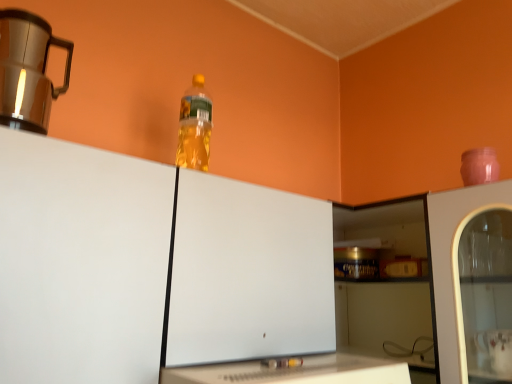
This screenshot has height=384, width=512. What do you see at coordinates (240, 277) in the screenshot?
I see `transparent plastic bottle at upper center` at bounding box center [240, 277].

Locate an element on the screen. translucent plastic bottle at upper center is located at coordinates (195, 127).

The height and width of the screenshot is (384, 512). I want to click on white glossy table at lower center, so click(294, 371).

You are a GUI agent. You are given a task and a screenshot of the screen. Output one action in this format:
    pyautogui.click(x=<x>, y=<y>)
    Task: Click on the brushed metal mug at upper left
    The image size is (512, 384).
    Given the screenshot: What is the action you would take?
    pyautogui.click(x=28, y=70)

Find the location of a particular element. transparent plastic bottle at upper center is located at coordinates (240, 277).

From a real-world perspective, which object stands above the other?

From a 3D spatial view, brushed metal mug at upper left is above.

Is brushed metal mug at upper left at the left side of transparent plastic bottle at upper center?

Yes.

Is brushed metal mug at upper left directly adjacent to transparent plastic bottle at upper center?

No, brushed metal mug at upper left is not with transparent plastic bottle at upper center.

What's the angular difference between brushed metal mug at upper left and translucent plastic bottle at upper center's facing directions?

0.248 degrees.

Which of these two, brushed metal mug at upper left or translucent plastic bottle at upper center, is smaller?

translucent plastic bottle at upper center is smaller.

Looking at this image, is brushed metal mug at upper left taller than translucent plastic bottle at upper center?

No, brushed metal mug at upper left is not taller than translucent plastic bottle at upper center.

From a real-world perspective, which object rests below the other?

brushed metal mug at upper left is physically lower.

From a real-world perspective, is transparent plastic bottle at upper center positioned above or below brushed metal mug at upper left?

transparent plastic bottle at upper center is below brushed metal mug at upper left.

Which is behind, point (322, 342) or point (45, 77)?

The point (322, 342) is behind.

Is transparent plastic bottle at upper center touching brushed metal mug at upper left?

transparent plastic bottle at upper center and brushed metal mug at upper left are clearly separated.

Between transparent plastic bottle at upper center and brushed metal mug at upper left, which one has more height?

With more height is transparent plastic bottle at upper center.

Is white glossy table at lower center turned away from brushed metal mug at upper left?

white glossy table at lower center does not have its back to brushed metal mug at upper left.

Can you confirm if white glossy table at lower center is wider than brushed metal mug at upper left?

Correct, the width of white glossy table at lower center exceeds that of brushed metal mug at upper left.

From the picture: Is white glossy table at lower center far away from brushed metal mug at upper left?

No, there isn't a large distance between white glossy table at lower center and brushed metal mug at upper left.

Between white glossy table at lower center and brushed metal mug at upper left, which one has less height?

white glossy table at lower center is shorter.

Is point (210, 133) closer to camera compared to point (385, 375)?

No.

In order to click on table on the right side of translucent plastic bottle at upper center in this screenshot , I will do `click(294, 371)`.

Considering the sizes of objects translucent plastic bottle at upper center and white glossy table at lower center in the image provided, who is thinner, translucent plastic bottle at upper center or white glossy table at lower center?

translucent plastic bottle at upper center is thinner.

Based on the photo, is translucent plastic bottle at upper center spatially inside white glossy table at lower center, or outside of it?

translucent plastic bottle at upper center is not inside white glossy table at lower center, it's outside.

Which object is further away from the camera taking this photo, brushed metal mug at upper left or white glossy table at lower center?

brushed metal mug at upper left is more distant.

How different are the orientations of brushed metal mug at upper left and white glossy table at lower center in degrees?

The facing directions of brushed metal mug at upper left and white glossy table at lower center are 0.453 degrees apart.

Between brushed metal mug at upper left and white glossy table at lower center, which one has larger width?

white glossy table at lower center is wider.

At what (x,y) coordinates should I click in order to perform the action: click on home appliance that is above the white glossy table at lower center (from the image's perspective). Please return your answer as a coordinate pair (x, y). Image resolution: width=512 pixels, height=384 pixels. Looking at the image, I should click on (28, 70).

Which object is positioned more to the left, translucent plastic bottle at upper center or transparent plastic bottle at upper center?

transparent plastic bottle at upper center.

Is translucent plastic bottle at upper center situated inside transparent plastic bottle at upper center or outside?

translucent plastic bottle at upper center is not inside transparent plastic bottle at upper center, it's outside.

Is point (178, 137) farther from viewer compared to point (313, 234)?

Yes, it is behind point (313, 234).

Is translucent plastic bottle at upper center bigger or smaller than transparent plastic bottle at upper center?

translucent plastic bottle at upper center is smaller than transparent plastic bottle at upper center.

What are the coordinates of `home appliance behind the transparent plastic bottle at upper center` in the screenshot? It's located at (28, 70).

At what (x,y) coordinates should I click in order to perform the action: click on home appliance on the left of translucent plastic bottle at upper center. Please return your answer as a coordinate pair (x, y). Looking at the image, I should click on (28, 70).

Which object lies further to the anchor point white glossy table at lower center, transparent plastic bottle at upper center or translucent plastic bottle at upper center?

Based on the image, translucent plastic bottle at upper center appears to be further to white glossy table at lower center.

From the image, which object appears to be nearer to transparent plastic bottle at upper center, translucent plastic bottle at upper center or brushed metal mug at upper left?

translucent plastic bottle at upper center.

From the image, which object appears to be farther from translucent plastic bottle at upper center, transparent plastic bottle at upper center or brushed metal mug at upper left?

transparent plastic bottle at upper center is further to translucent plastic bottle at upper center.

Which object lies nearer to the anchor point transparent plastic bottle at upper center, brushed metal mug at upper left or white glossy table at lower center?

Based on the image, white glossy table at lower center appears to be nearer to transparent plastic bottle at upper center.

Estimate the real-world distances between objects in this image. Which object is further from white glossy table at lower center, transparent plastic bottle at upper center or brushed metal mug at upper left?

The object further to white glossy table at lower center is brushed metal mug at upper left.

Looking at the image, which one is located closer to brushed metal mug at upper left, white glossy table at lower center or transparent plastic bottle at upper center?

transparent plastic bottle at upper center is closer to brushed metal mug at upper left.

Considering their positions, is white glossy table at lower center positioned closer to translucent plastic bottle at upper center than transparent plastic bottle at upper center?

transparent plastic bottle at upper center is closer to translucent plastic bottle at upper center.

From the image, which object appears to be farther from white glossy table at lower center, translucent plastic bottle at upper center or brushed metal mug at upper left?

Based on the image, brushed metal mug at upper left appears to be further to white glossy table at lower center.

Identify the location of cabinetry between translucent plastic bottle at upper center and white glossy table at lower center from top to bottom. This screenshot has width=512, height=384. (240, 277).

What are the coordinates of `cabinetry between brushed metal mug at upper left and white glossy table at lower center in the vertical direction` in the screenshot? It's located at (240, 277).

I want to click on bottle between brushed metal mug at upper left and white glossy table at lower center in the vertical direction, so 195,127.

Find the location of a particular element. Image resolution: width=512 pixels, height=384 pixels. bottle that lies between brushed metal mug at upper left and transparent plastic bottle at upper center from top to bottom is located at coordinates (195, 127).